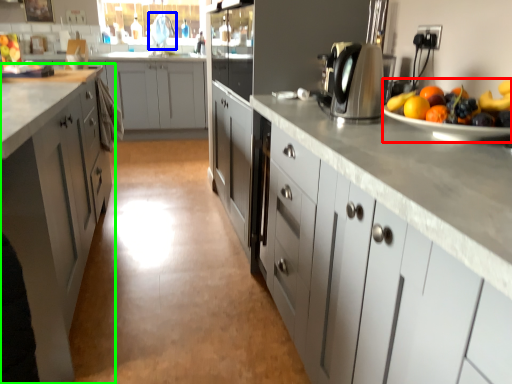
Question: Which object is positioned closest to fruit salad (highlighted by a red box)? Select from faucet (highlighted by a blue box) and cabinetry (highlighted by a green box).

Choices:
 (A) faucet
 (B) cabinetry

Answer: (B)